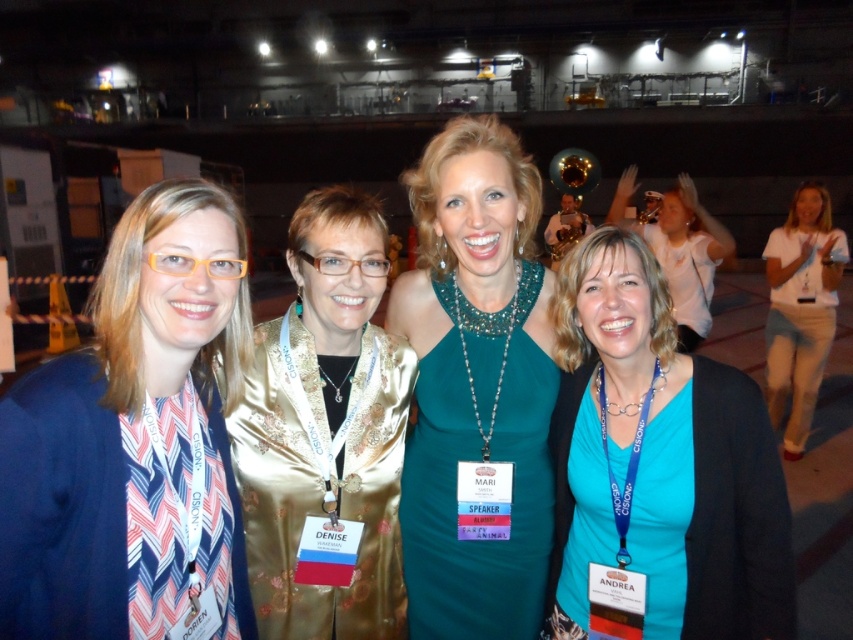
Can you confirm if teal matte shirt at center is smaller than gold satin blouse at center?

Actually, teal matte shirt at center might be larger than gold satin blouse at center.

Based on the photo, who is more forward, (657,376) or (369,248)?

Point (369,248) is in front.

This screenshot has height=640, width=853. Identify the location of teal matte shirt at center. [660, 460].

Is matte blue blazer at left wider than teal matte shirt at center?

No, matte blue blazer at left is not wider than teal matte shirt at center.

Is matte blue blazer at left in front of teal matte shirt at center?

Yes.

Is point (71, 480) positioned after point (718, 586)?

No, (71, 480) is closer to viewer.

Locate an element on the screen. Image resolution: width=853 pixels, height=640 pixels. matte blue blazer at left is located at coordinates (125, 452).

Who is more forward, (521, 417) or (798, 195)?

Point (521, 417) is in front.

Does point (525, 419) lie behind point (802, 445)?

No, it is not.

The width and height of the screenshot is (853, 640). Find the location of `teal satin dress at center`. teal satin dress at center is located at coordinates (474, 384).